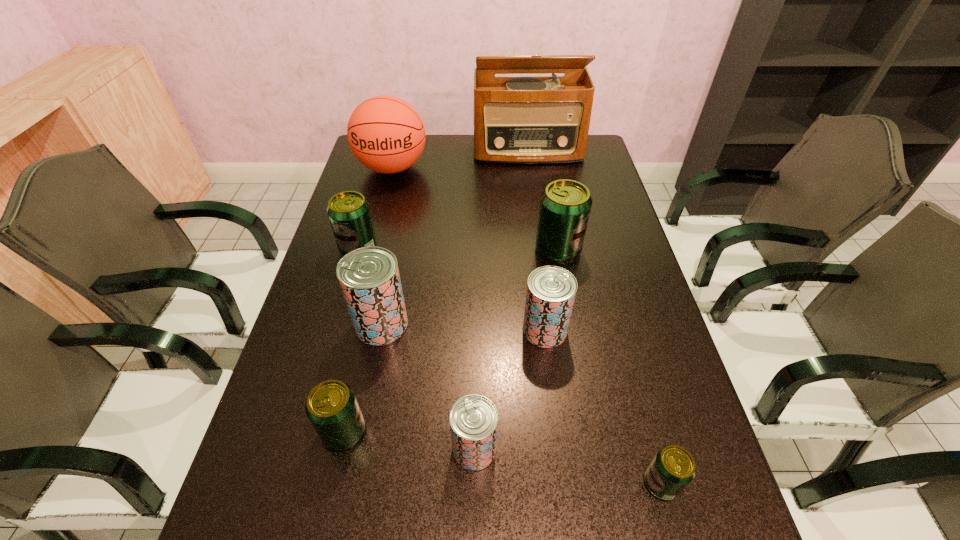
The height and width of the screenshot is (540, 960). What are the coordinates of `free spot that satisfies the following two spatial constraints: 1. on the front side of the rightmost red beer can; 2. on the left side of the rightmost beer can` in the screenshot? It's located at (564, 483).